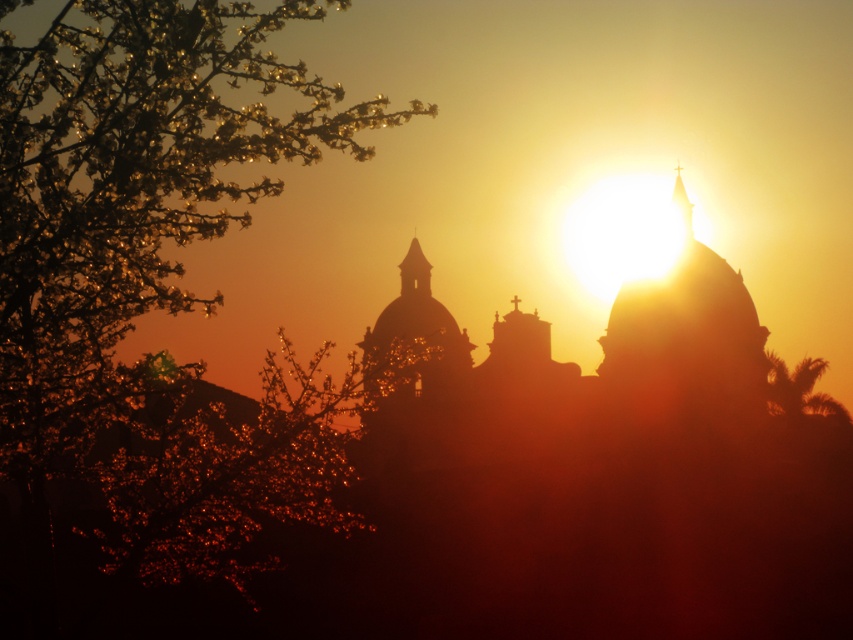
Is matte gold spire at center below transparent glass spire at upper center?

Indeed, matte gold spire at center is positioned under transparent glass spire at upper center.

Is matte gold spire at center shorter than transparent glass spire at upper center?

Indeed, matte gold spire at center has a lesser height compared to transparent glass spire at upper center.

Is point (424, 280) less distant than point (691, 211)?

No, (424, 280) is behind (691, 211).

Image resolution: width=853 pixels, height=640 pixels. I want to click on matte gold spire at center, so click(x=415, y=272).

Which is below, green leafy palm at right or matte gold spire at center?

green leafy palm at right is below.

Is green leafy palm at right to the left of matte gold spire at center from the viewer's perspective?

Incorrect, green leafy palm at right is not on the left side of matte gold spire at center.

At what (x,y) coordinates should I click in order to perform the action: click on green leafy palm at right. Please return your answer as a coordinate pair (x, y). Image resolution: width=853 pixels, height=640 pixels. Looking at the image, I should click on (799, 388).

This screenshot has height=640, width=853. What are the coordinates of `green leafy palm at right` in the screenshot? It's located at (799, 388).

Between green leafy palm at right and transparent glass spire at upper center, which one has less height?

With less height is green leafy palm at right.

Which is above, green leafy palm at right or transparent glass spire at upper center?

transparent glass spire at upper center is higher up.

Does point (815, 365) come behind point (683, 208)?

No, it is not.

This screenshot has width=853, height=640. I want to click on green leafy palm at right, so click(x=799, y=388).